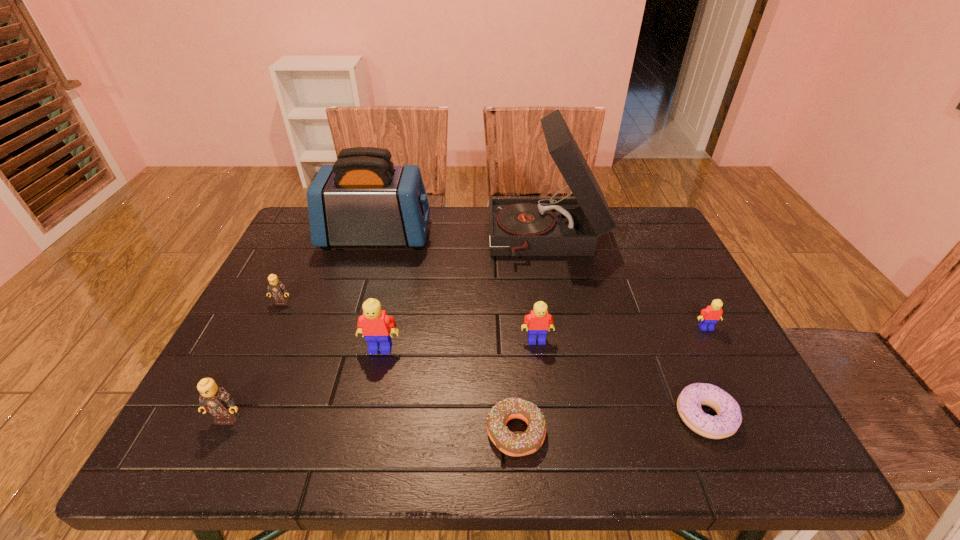
Image resolution: width=960 pixels, height=540 pixels. Find the location of `empty location between the chocolate doughnut and the purple doughnut`. empty location between the chocolate doughnut and the purple doughnut is located at coordinates point(610,424).

This screenshot has width=960, height=540. What are the coordinates of `free area in between the tallest Lego and the phonograph_record` in the screenshot? It's located at (464, 294).

Locate an element on the screen. This screenshot has width=960, height=540. empty space that is in between the left doughnut and the seventh shortest object is located at coordinates (448, 390).

Locate an element on the screen. The width and height of the screenshot is (960, 540). free space between the chocolate doughnut and the second yellow Lego from left to right is located at coordinates (526, 386).

Image resolution: width=960 pixels, height=540 pixels. What are the coordinates of `free space between the nearest Lego and the rightmost Lego` in the screenshot? It's located at (467, 373).

I want to click on free space between the second Lego from right to left and the purple doughnut, so click(x=620, y=378).

The height and width of the screenshot is (540, 960). What are the coordinates of `empty location between the right doughnut and the second Lego from right to left` in the screenshot? It's located at (620, 378).

At what (x,y) coordinates should I click in order to perform the action: click on empty location between the third Lego from left to right and the fourth Lego from left to right. Please return your answer as a coordinate pair (x, y). The height and width of the screenshot is (540, 960). Looking at the image, I should click on (459, 345).

You are a GUI agent. You are given a task and a screenshot of the screen. Output one action in this format:
    pyautogui.click(x=<x>, y=<y>)
    Task: Click on the free space between the farthest Lego and the second tallest object
    Image resolution: width=960 pixels, height=540 pixels.
    Given the screenshot: What is the action you would take?
    pyautogui.click(x=329, y=269)

Locate which object ranks second in proximity to the chocolate doughnut. Please provide its 2D coordinates. Your answer should be formatted as a tuple, i.e. [(x, y)], where the tuple contains the x and y coordinates of a point satisfying the conditions above.

[(374, 324)]